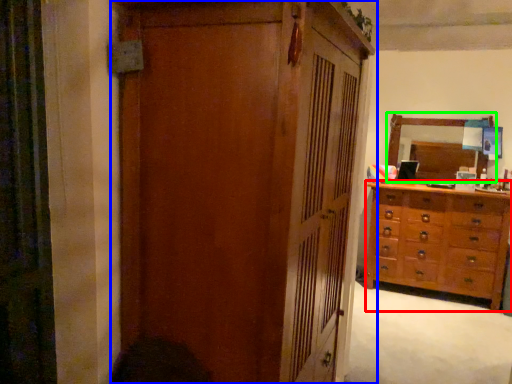
Question: Considering the real-world distances, which object is closest to chest of drawers (highlighted by a red box)? cupboard (highlighted by a blue box) or mirror (highlighted by a green box).

Choices:
 (A) cupboard
 (B) mirror

Answer: (B)